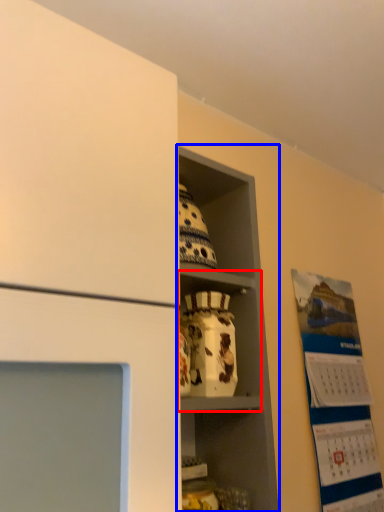
Question: Which object is further to the camera taking this photo, cabinet (highlighted by a red box) or shelf (highlighted by a blue box)?

Choices:
 (A) cabinet
 (B) shelf

Answer: (A)